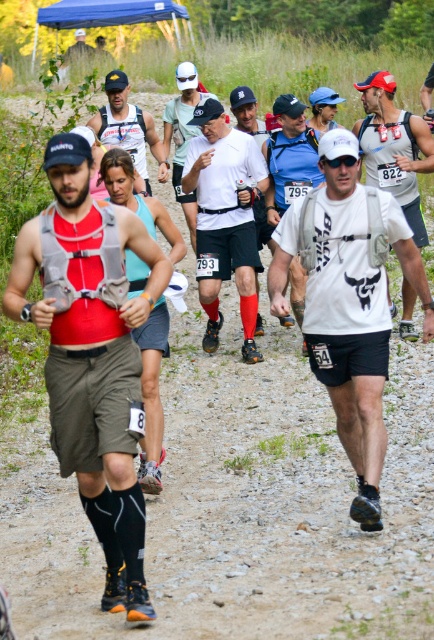
From the picture: You are a race official trying to locate the runner wearing the matte gray vest at left. According to the coordinate system where the bottom left corner is the origin, can you confirm if the runner is positioned in the upper half of the image?

The matte gray vest at left is located at coordinate point (92, 355). Since the y coordinate 0.212 is less than 0.5, the runner is in the lower half of the image.